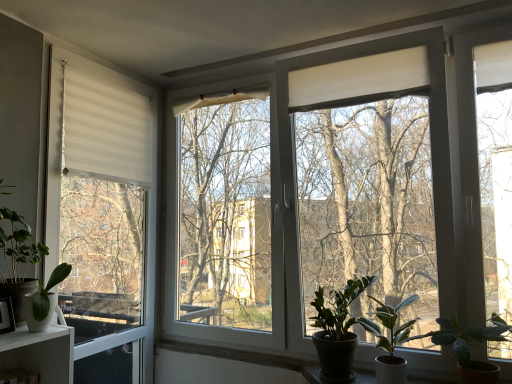
This screenshot has width=512, height=384. Find the location of `white matte window at left`. white matte window at left is located at coordinates (103, 215).

From the picture: Measure the distance between point (x=365, y=322) and camera.

A distance of 5.99 feet exists between point (x=365, y=322) and camera.

Measure the distance between point [38,292] and camera.

Point [38,292] and camera are 5.01 feet apart from each other.

The width and height of the screenshot is (512, 384). What do you see at coordinates (469, 345) in the screenshot?
I see `green matte plant at lower right, which appears as the 5th houseplant when viewed from the left` at bounding box center [469, 345].

Where is `green matte plant at left, which is counted as the first houseplant, starting from the left`? This screenshot has height=384, width=512. green matte plant at left, which is counted as the first houseplant, starting from the left is located at coordinates (18, 245).

Where is `white matte window at left`? This screenshot has height=384, width=512. white matte window at left is located at coordinates tap(103, 215).

Which houseplant is the 1st one when counting from the right side of the dark green glossy plant at lower right, arranged as the third houseplant when viewed from the left? Please provide its 2D coordinates.

[(391, 340)]

How many degrees apart are the facing directions of green matte plant at lower right, the second houseplant in the right-to-left sequence, and dark green glossy plant at lower right, arranged as the third houseplant when viewed from the left?

There is a 0.000311-degree angle between the facing directions of green matte plant at lower right, the second houseplant in the right-to-left sequence, and dark green glossy plant at lower right, arranged as the third houseplant when viewed from the left.

Can you confirm if green matte plant at lower right, which is the 4th houseplant in left-to-right order, is thinner than dark green glossy plant at lower right, arranged as the third houseplant when viewed from the left?

No, green matte plant at lower right, which is the 4th houseplant in left-to-right order, is not thinner than dark green glossy plant at lower right, arranged as the third houseplant when viewed from the left.

Considering the positions of points (375, 313) and (340, 308), is point (375, 313) closer to camera compared to point (340, 308)?

No, (375, 313) is further to viewer.

Could you tell me if green matte plant at left, which is counted as the first houseplant, starting from the left, is facing green matte plant at lower right, which is the 4th houseplant in left-to-right order?

No, green matte plant at left, which is counted as the first houseplant, starting from the left, is not turned towards green matte plant at lower right, which is the 4th houseplant in left-to-right order.

Considering the sizes of objects green matte plant at left, the 5th houseplant viewed from the right, and green matte plant at lower right, which is the 4th houseplant in left-to-right order, in the image provided, who is taller, green matte plant at left, the 5th houseplant viewed from the right, or green matte plant at lower right, which is the 4th houseplant in left-to-right order,?

green matte plant at left, the 5th houseplant viewed from the right.

How many degrees apart are the facing directions of green matte plant at left, the 5th houseplant viewed from the right, and green matte plant at lower right, which is the 4th houseplant in left-to-right order?

green matte plant at left, the 5th houseplant viewed from the right, and green matte plant at lower right, which is the 4th houseplant in left-to-right order, are facing 88.1 degrees away from each other.

Which is in front, point (143, 307) or point (321, 349)?

The point (321, 349) is more forward.

Is white matte window at left not close to dark green glossy plant at lower right, arranged as the third houseplant when viewed from the left?

Yes, white matte window at left is far from dark green glossy plant at lower right, arranged as the third houseplant when viewed from the left.

Is white matte window at left taller or shorter than dark green glossy plant at lower right, the third houseplant positioned from the right?

In the image, white matte window at left appears to be taller than dark green glossy plant at lower right, the third houseplant positioned from the right.

How many degrees apart are the facing directions of white matte window at left and dark green glossy plant at lower right, arranged as the third houseplant when viewed from the left?

The angular difference between white matte window at left and dark green glossy plant at lower right, arranged as the third houseplant when viewed from the left, is 90.9 degrees.

Considering the positions of points (323, 329) and (23, 304), is point (323, 329) closer to camera compared to point (23, 304)?

That is False.

You are a GUI agent. You are given a task and a screenshot of the screen. Output one action in this format:
    pyautogui.click(x=<x>, y=<y>)
    Task: Click on the 1st houseplant counting from the left of the dark green glossy plant at lower right, the third houseplant positioned from the right
    This screenshot has width=512, height=384.
    Given the screenshot: What is the action you would take?
    pyautogui.click(x=44, y=300)

Can you tell me how much dark green glossy plant at lower right, the third houseplant positioned from the right, and white matte pot at lower left, which is the 4th houseplant from right to left, differ in facing direction?

dark green glossy plant at lower right, the third houseplant positioned from the right, and white matte pot at lower left, which is the 4th houseplant from right to left, are facing 88.1 degrees away from each other.

Is dark green glossy plant at lower right, arranged as the third houseplant when viewed from the left, oriented towards white matte pot at lower left, which is counted as the second houseplant, starting from the left?

No, dark green glossy plant at lower right, arranged as the third houseplant when viewed from the left, does not turn towards white matte pot at lower left, which is counted as the second houseplant, starting from the left.

Based on their sizes in the image, would you say white matte pot at lower left, which is the 4th houseplant from right to left, is bigger or smaller than green matte plant at lower right, which appears as the 5th houseplant when viewed from the left?

Clearly, white matte pot at lower left, which is the 4th houseplant from right to left, is smaller in size than green matte plant at lower right, which appears as the 5th houseplant when viewed from the left.

Is point (41, 323) behind point (461, 335)?

No.

Considering the relative positions of white matte pot at lower left, which is the 4th houseplant from right to left, and green matte plant at lower right, which is the first houseplant from right to left, in the image provided, is white matte pot at lower left, which is the 4th houseplant from right to left, to the left or to the right of green matte plant at lower right, which is the first houseplant from right to left,?

white matte pot at lower left, which is the 4th houseplant from right to left, is positioned on green matte plant at lower right, which is the first houseplant from right to left,'s left side.

Is white matte pot at lower left, which is counted as the second houseplant, starting from the left, facing away from green matte plant at lower right, which appears as the 5th houseplant when viewed from the left?

white matte pot at lower left, which is counted as the second houseplant, starting from the left, does not have its back to green matte plant at lower right, which appears as the 5th houseplant when viewed from the left.

Is white matte window at left not within white matte pot at lower left, which is counted as the second houseplant, starting from the left?

That's correct, white matte window at left is outside of white matte pot at lower left, which is counted as the second houseplant, starting from the left.

How different are the orientations of white matte window at left and white matte pot at lower left, which is the 4th houseplant from right to left, in degrees?

The facing directions of white matte window at left and white matte pot at lower left, which is the 4th houseplant from right to left, are 2.74 degrees apart.

Is white matte window at left in front of or behind white matte pot at lower left, which is counted as the second houseplant, starting from the left, in the image?

white matte window at left is positioned farther from the viewer than white matte pot at lower left, which is counted as the second houseplant, starting from the left.

Measure the distance from white matte window at left to white matte pot at lower left, which is the 4th houseplant from right to left.

The distance of white matte window at left from white matte pot at lower left, which is the 4th houseplant from right to left, is 27.80 inches.

Between green matte plant at left, which is counted as the first houseplant, starting from the left, and white matte window at left, which one has smaller width?

white matte window at left is thinner.

Which point is more forward, (x=10, y=280) or (x=45, y=262)?

The point (x=10, y=280) is more forward.

From the image's perspective, does green matte plant at left, the 5th houseplant viewed from the right, appear higher than white matte window at left?

No, from the image's perspective, green matte plant at left, the 5th houseplant viewed from the right, is not on top of white matte window at left.

The image size is (512, 384). I want to click on the 1st houseplant in front of the dark green glossy plant at lower right, arranged as the third houseplant when viewed from the left, so click(x=391, y=340).

Where is `the 3rd houseplant directly beneath the green matte plant at left, the 5th houseplant viewed from the right (from a real-world perspective)`? The height and width of the screenshot is (384, 512). the 3rd houseplant directly beneath the green matte plant at left, the 5th houseplant viewed from the right (from a real-world perspective) is located at coordinates (391, 340).

From the image, which object appears to be farther from green matte plant at lower right, which is the 4th houseplant in left-to-right order, white matte pot at lower left, which is counted as the second houseplant, starting from the left, or green matte plant at lower right, which appears as the 5th houseplant when viewed from the left?

The object further to green matte plant at lower right, which is the 4th houseplant in left-to-right order, is white matte pot at lower left, which is counted as the second houseplant, starting from the left.

Based on their spatial positions, is green matte plant at left, the 5th houseplant viewed from the right, or green matte plant at lower right, which is the 4th houseplant in left-to-right order, further from dark green glossy plant at lower right, the third houseplant positioned from the right?

green matte plant at left, the 5th houseplant viewed from the right, is further to dark green glossy plant at lower right, the third houseplant positioned from the right.

When comparing their distances from green matte plant at lower right, the second houseplant in the right-to-left sequence, does dark green glossy plant at lower right, arranged as the third houseplant when viewed from the left, or white matte pot at lower left, which is the 4th houseplant from right to left, seem closer?

dark green glossy plant at lower right, arranged as the third houseplant when viewed from the left, is positioned closer to the anchor green matte plant at lower right, the second houseplant in the right-to-left sequence.

Based on their spatial positions, is dark green glossy plant at lower right, the third houseplant positioned from the right, or green matte plant at left, which is counted as the first houseplant, starting from the left, further from white matte pot at lower left, which is counted as the second houseplant, starting from the left?

The object further to white matte pot at lower left, which is counted as the second houseplant, starting from the left, is dark green glossy plant at lower right, the third houseplant positioned from the right.

Looking at the image, which one is located closer to dark green glossy plant at lower right, arranged as the third houseplant when viewed from the left, white matte window at left or green matte plant at lower right, the second houseplant in the right-to-left sequence?

green matte plant at lower right, the second houseplant in the right-to-left sequence, is closer to dark green glossy plant at lower right, arranged as the third houseplant when viewed from the left.

Considering their positions, is white matte window at left positioned closer to green matte plant at left, which is counted as the first houseplant, starting from the left, than dark green glossy plant at lower right, the third houseplant positioned from the right?

white matte window at left lies closer to green matte plant at left, which is counted as the first houseplant, starting from the left, than the other object.

Estimate the real-world distances between objects in this image. Which object is further from white matte pot at lower left, which is the 4th houseplant from right to left, dark green glossy plant at lower right, arranged as the third houseplant when viewed from the left, or green matte plant at lower right, which is the first houseplant from right to left?

Based on the image, green matte plant at lower right, which is the first houseplant from right to left, appears to be further to white matte pot at lower left, which is the 4th houseplant from right to left.

From the picture: When comparing their distances from dark green glossy plant at lower right, arranged as the third houseplant when viewed from the left, does green matte plant at left, the 5th houseplant viewed from the right, or white matte window at left seem closer?

green matte plant at left, the 5th houseplant viewed from the right.

Find the location of a particular element. The height and width of the screenshot is (384, 512). window situated between green matte plant at left, the 5th houseplant viewed from the right, and dark green glossy plant at lower right, the third houseplant positioned from the right, from left to right is located at coordinates pos(103,215).

What are the coordinates of `window between green matte plant at left, the 5th houseplant viewed from the right, and green matte plant at lower right, which is the 4th houseplant in left-to-right order` in the screenshot? It's located at (103, 215).

Identify the location of houseplant between dark green glossy plant at lower right, arranged as the third houseplant when viewed from the left, and green matte plant at lower right, which appears as the 5th houseplant when viewed from the left, in the horizontal direction. (391, 340).

You are a GUI agent. You are given a task and a screenshot of the screen. Output one action in this format:
    pyautogui.click(x=<x>, y=<y>)
    Task: Click on the houseplant located between white matte window at left and dark green glossy plant at lower right, the third houseplant positioned from the right, in the left-right direction
    This screenshot has height=384, width=512.
    Given the screenshot: What is the action you would take?
    pyautogui.click(x=44, y=300)